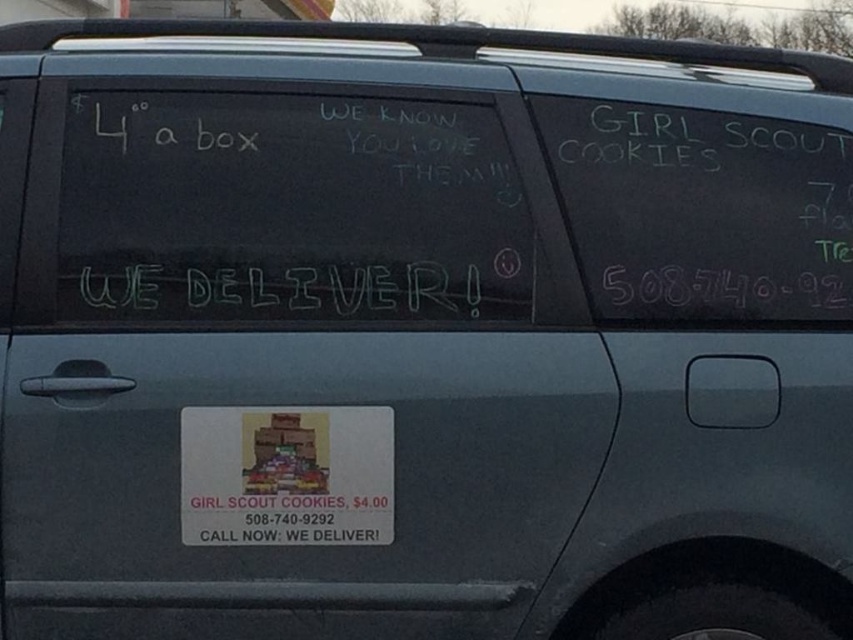
Question: Which of the following is the farthest from the observer?

Choices:
 (A) white chalk writing at center
 (B) white chalkboard at center

Answer: (A)

Question: Observing the image, what is the correct spatial positioning of white chalkboard at center in reference to white chalk writing at center?

Choices:
 (A) above
 (B) below

Answer: (A)

Question: Observing the image, what is the correct spatial positioning of white chalkboard at center in reference to white chalk writing at center?

Choices:
 (A) right
 (B) left

Answer: (A)

Question: Is white chalkboard at center smaller than white chalk writing at center?

Choices:
 (A) yes
 (B) no

Answer: (B)

Question: Which of the following is the closest to the observer?

Choices:
 (A) white chalkboard at center
 (B) white chalk writing at center

Answer: (A)